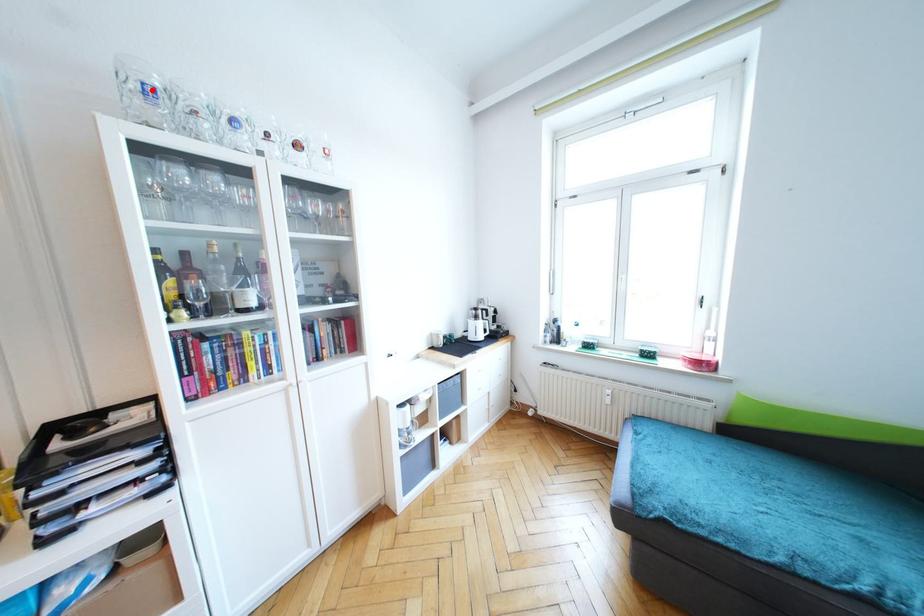
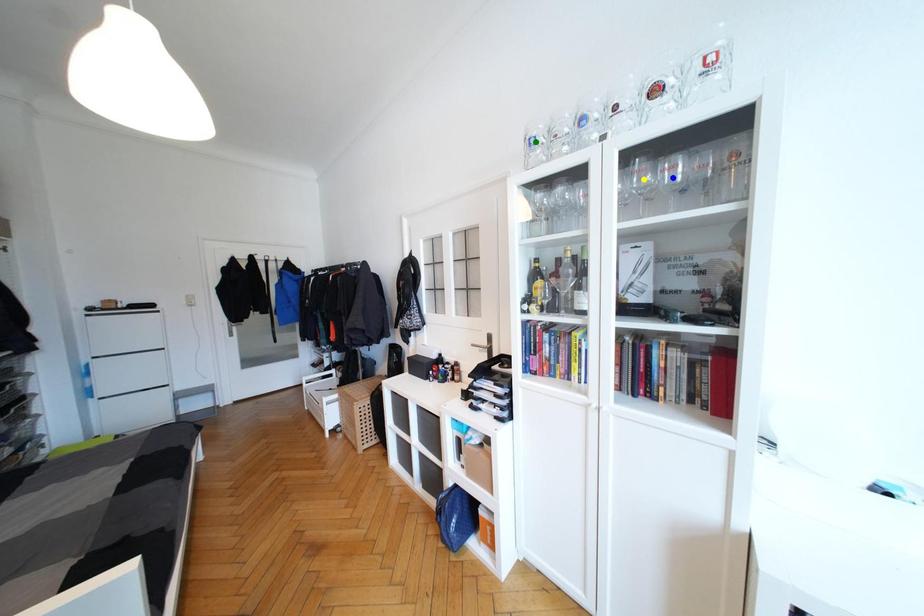
Question: I am providing you with two images of the same scene from different viewpoints. A red point is marked on the first image. You are given multiple points on the second image. Which mark in image 2 goes with the point in image 1?

Choices:
 (A) green point
 (B) blue point
 (C) yellow point

Answer: (A)